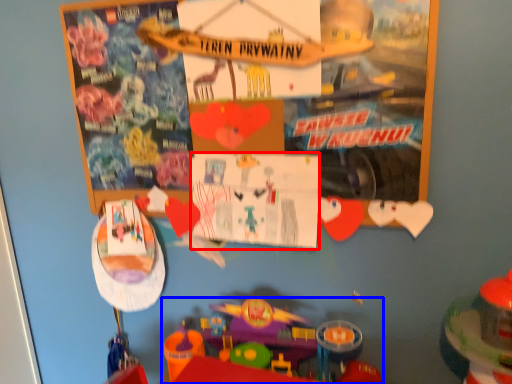
Question: Which object is closer to the camera taking this photo, poster page (highlighted by a red box) or toy (highlighted by a blue box)?

Choices:
 (A) poster page
 (B) toy

Answer: (B)